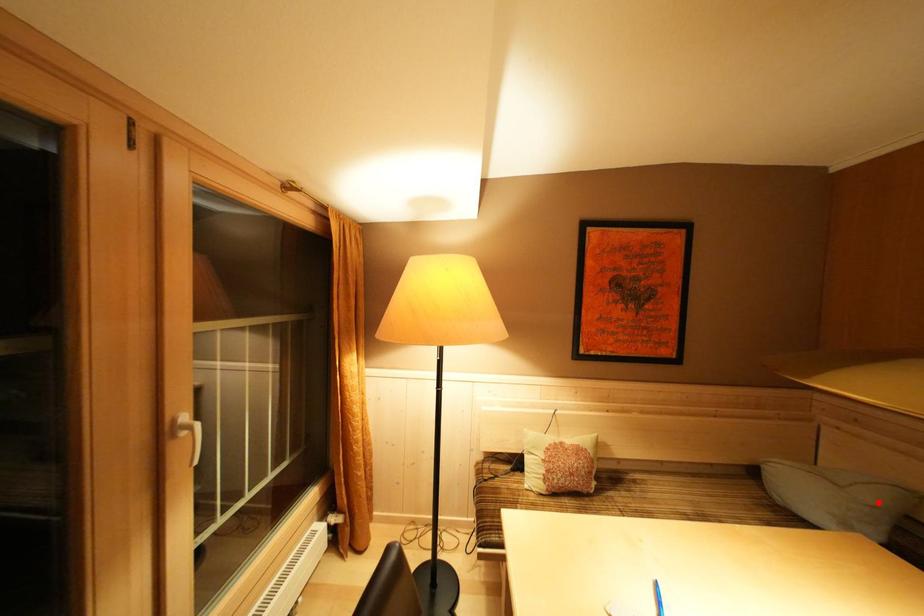
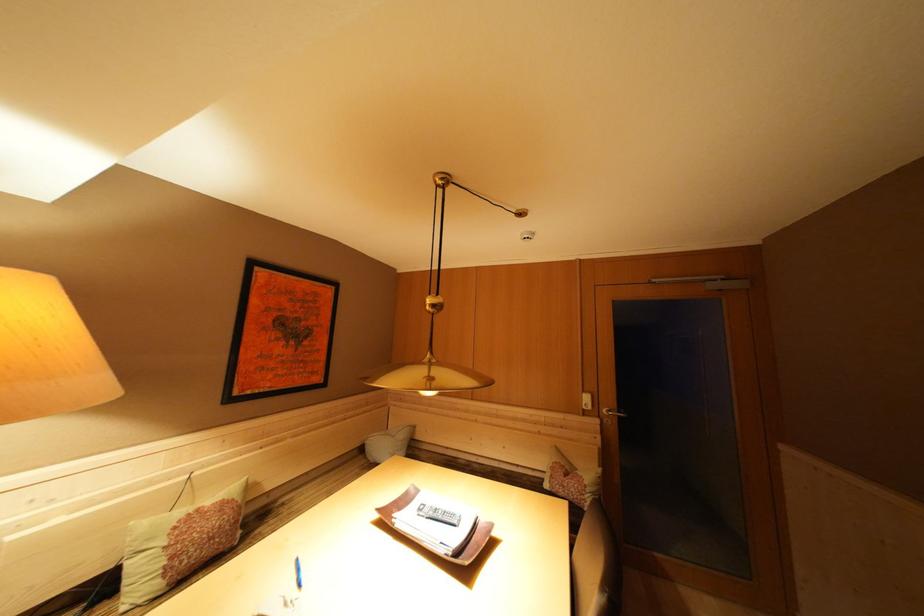
Question: I am providing you with two images of the same scene from different viewpoints. A red point is marked on the first image. At the location where the point appears in image 1, is it still visible in image 2?

Choices:
 (A) Yes
 (B) No

Answer: (A)